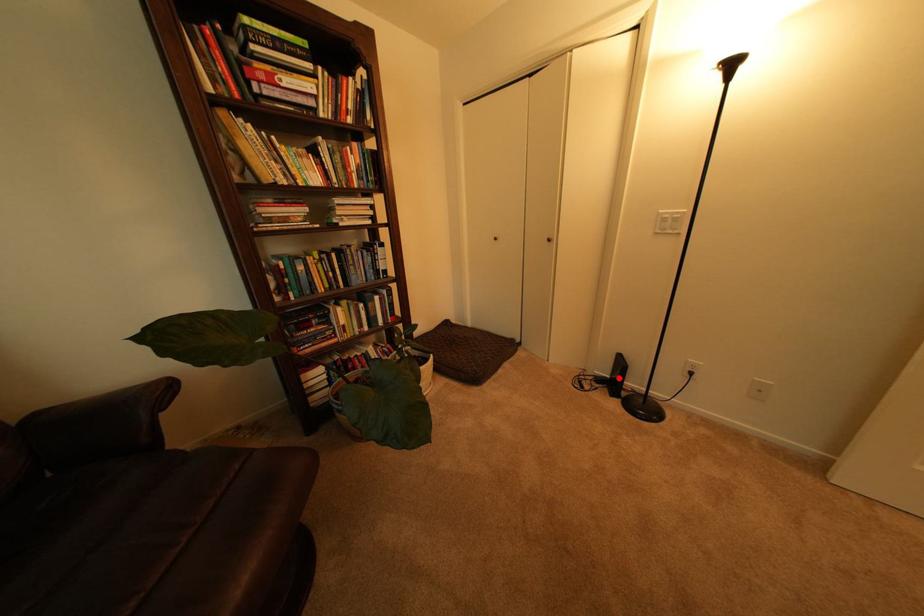
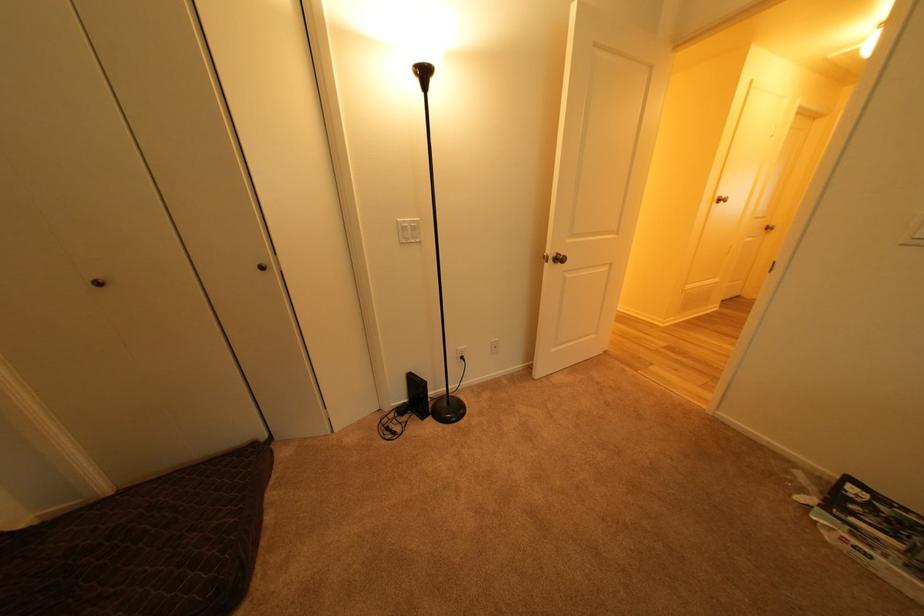
Find the pixel in the second image that matches the highlighted location in the first image.

(417, 402)